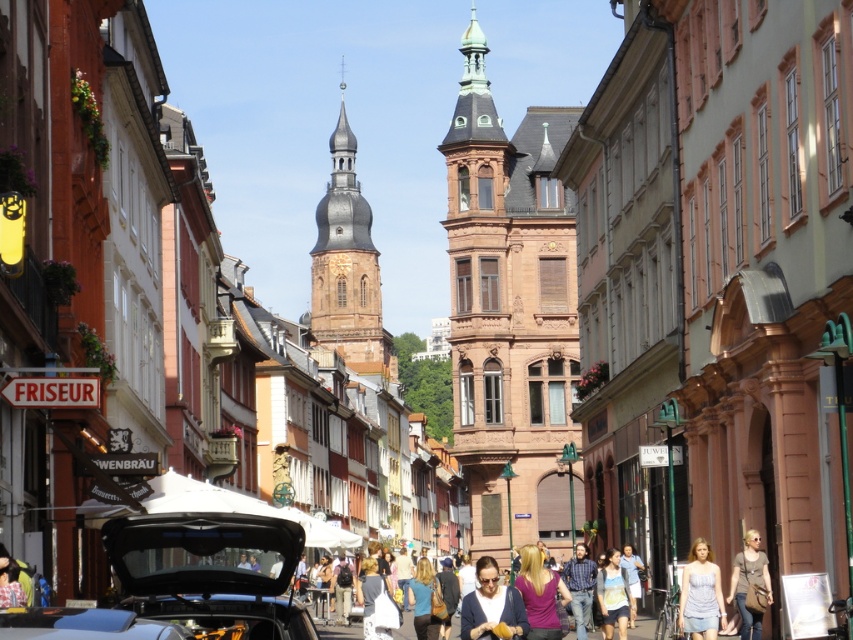
Question: Can you confirm if light blue denim skirt at lower right is positioned below blue plaid shirt at center?

Choices:
 (A) no
 (B) yes

Answer: (A)

Question: Can you confirm if shiny black car at lower left is thinner than matte black jacket at center?

Choices:
 (A) yes
 (B) no

Answer: (A)

Question: Which point is closer to the camera?

Choices:
 (A) brown stone tower at center
 (B) shiny blue car at center
 (C) light brown leather jacket at lower right

Answer: (B)

Question: Among these points, which one is nearest to the camera?

Choices:
 (A) (703, 609)
 (B) (0, 634)
 (C) (467, 138)

Answer: (B)

Question: Which object is the closest to the purple matte shirt at lower center?

Choices:
 (A) blue plaid shirt at center
 (B) matte black jacket at center
 (C) light blue denim shorts at center

Answer: (B)

Question: Is brown stone bell tower at center above light blue denim shorts at center?

Choices:
 (A) yes
 (B) no

Answer: (A)